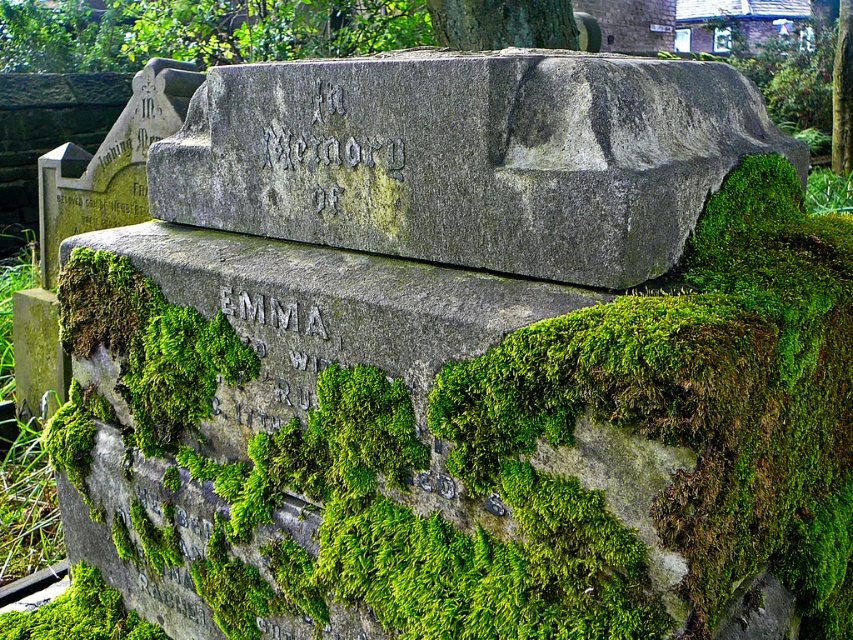
You are a landscape architect designing a garden pathway. You have two stones to choose from for the pathway surface. The green mossy stone at center is covered in moss, and the gray stone boulder at center is larger. Based on their sizes, which stone would you select to ensure the pathway remains stable and secure?

The gray stone boulder at center is larger than the green mossy stone at center, so it would provide a more stable and secure base for the pathway.

You are a stonemason assessing two stones in a cemetery. You see the green mossy stone at center and the gray stone boulder at center. Which stone is taller?

The green mossy stone at center is taller than the gray stone boulder at center.